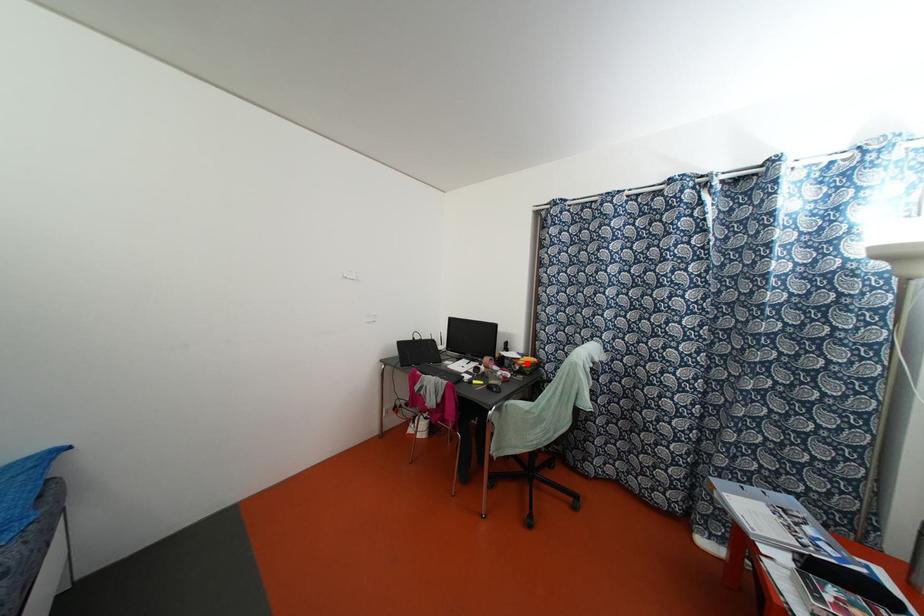
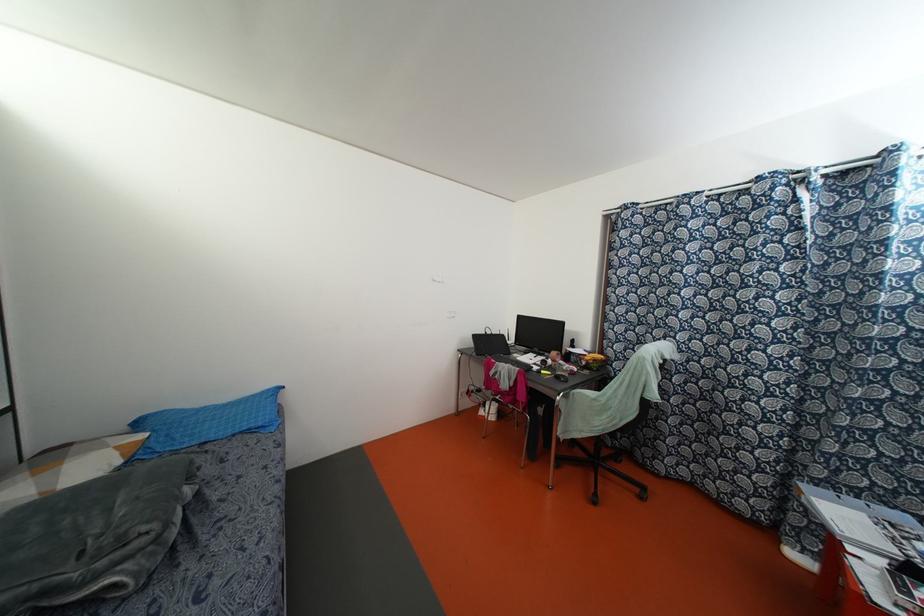
In the second image, find the point that corresponds to the highlighted location in the first image.

(593, 360)